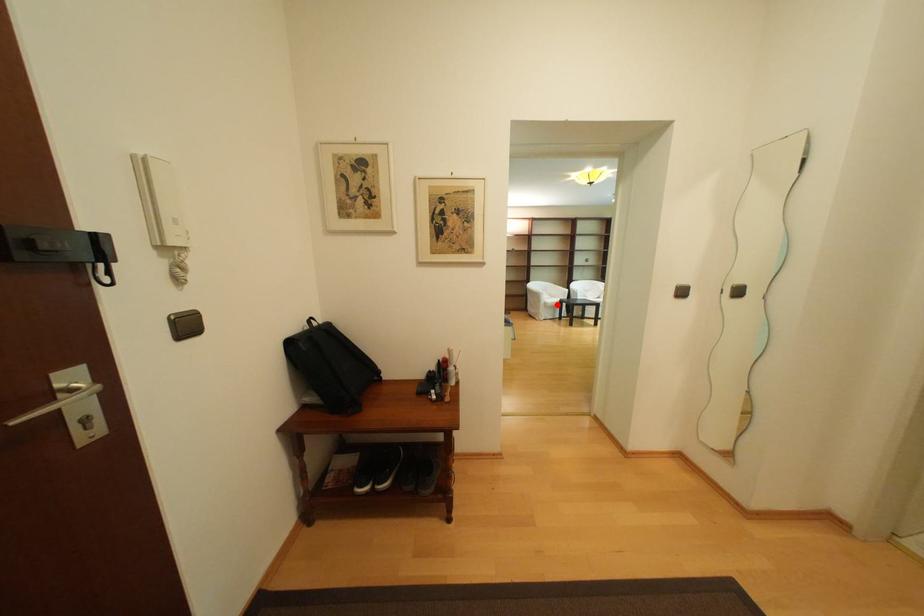
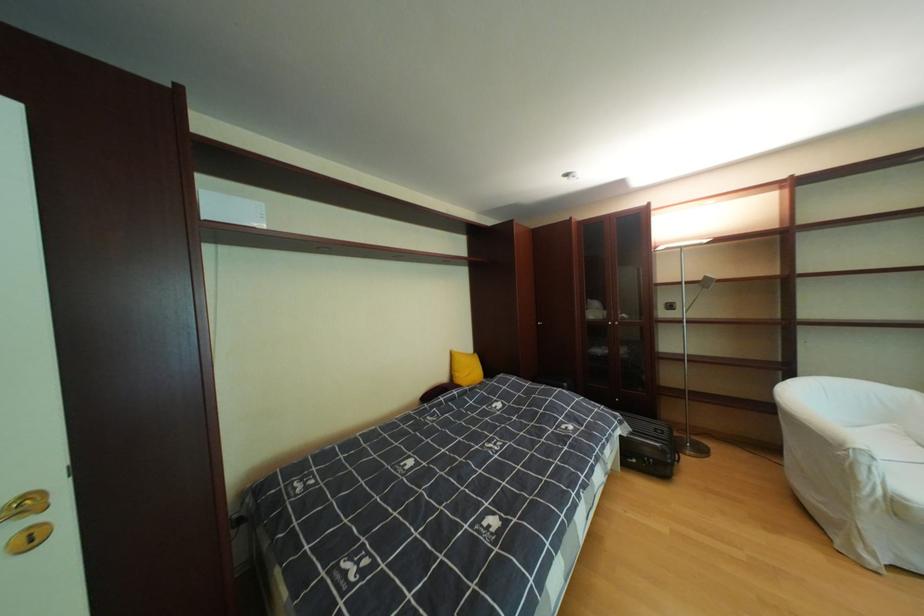
Find the pixel in the second image that matches the highlighted location in the first image.

(908, 506)